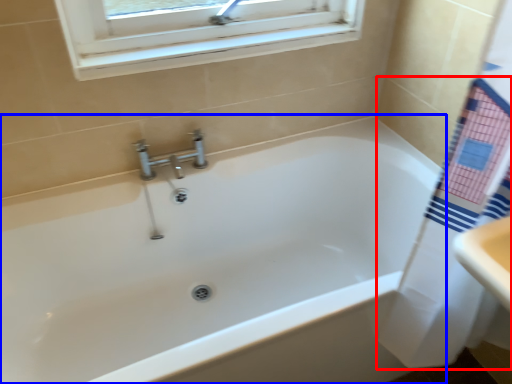
Question: Which point is further to the camera, bath towel (highlighted by a red box) or bathtub (highlighted by a blue box)?

Choices:
 (A) bath towel
 (B) bathtub

Answer: (B)